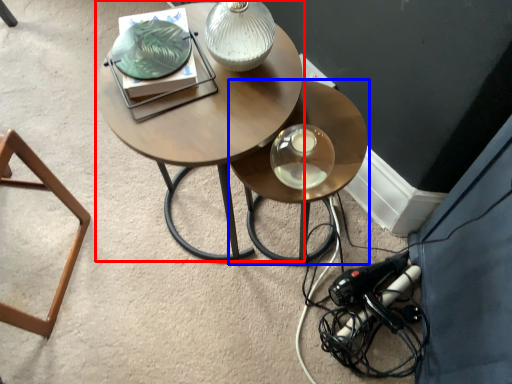
Question: Which object appears closest to the camera in this image, coffee table (highlighted by a red box) or table (highlighted by a blue box)?

Choices:
 (A) coffee table
 (B) table

Answer: (A)